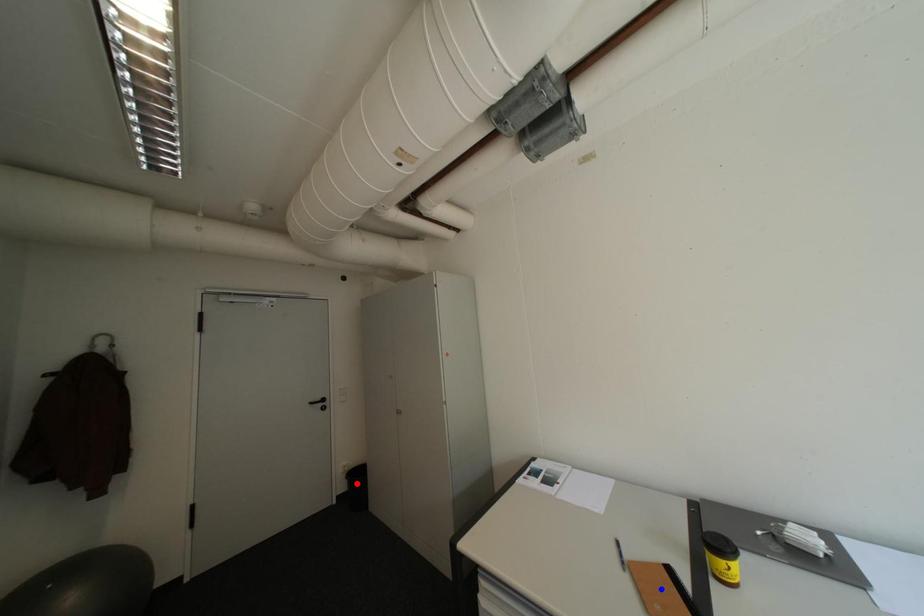
Question: Two points are marked on the image. Which point is closer to the camera?

Choices:
 (A) Blue point is closer.
 (B) Red point is closer.

Answer: (A)